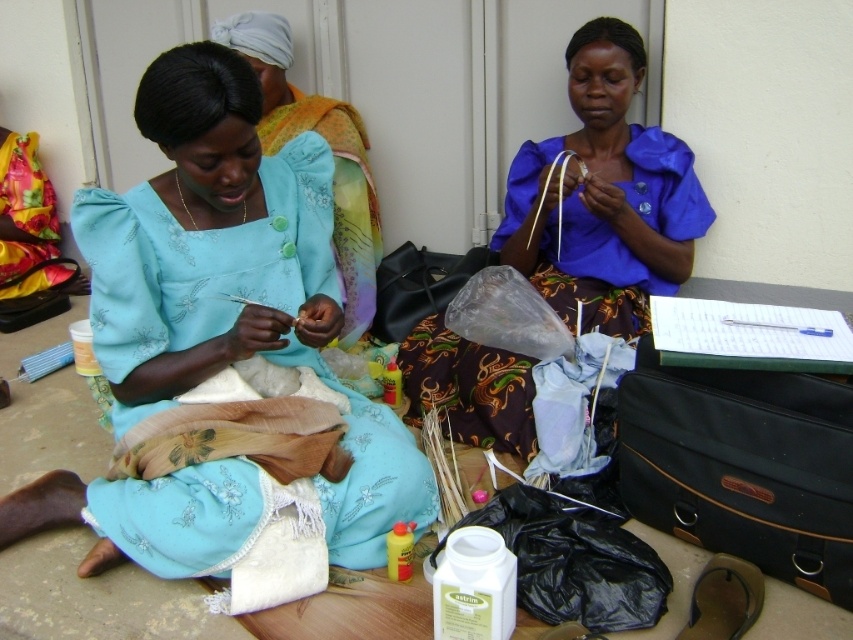
You are organizing a craft fair and need to display the matte blue fabric at center and the matte blue blouse at center on a table. Based on their widths, which item should be placed on the left side to ensure they both fit on the table without overlapping?

The matte blue fabric at center should be placed on the left side because its width is greater than the matte blue blouse at center, allowing both items to fit without overlapping by positioning the wider item first.

You are standing in the room where the women are crafting. You want to move from the point at coordinates point (323, 262) to the point at coordinates point (512, 260). Is the destination point behind or in front of your starting position?

The point at coordinates point (512, 260) is behind the point at coordinates point (323, 262) since the first point is in front of the second one according to the description.